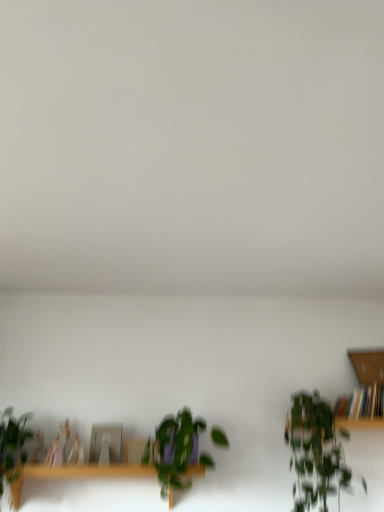
Question: Is green leafy plant at right, marked as the first houseplant in a right-to-left arrangement, beside green leafy plant at center, which appears as the 2th houseplant when viewed from the left?

Choices:
 (A) no
 (B) yes

Answer: (A)

Question: Does green leafy plant at right, marked as the first houseplant in a right-to-left arrangement, have a greater width compared to green leafy plant at center, which appears as the 2th houseplant when viewed from the left?

Choices:
 (A) no
 (B) yes

Answer: (B)

Question: Would you say green leafy plant at right, marked as the first houseplant in a right-to-left arrangement, is a long distance from green leafy plant at center, which appears as the 2th houseplant when viewed from the right?

Choices:
 (A) yes
 (B) no

Answer: (B)

Question: Does green leafy plant at right, the third houseplant positioned from the left, have a lesser height compared to green leafy plant at center, which appears as the 2th houseplant when viewed from the right?

Choices:
 (A) no
 (B) yes

Answer: (A)

Question: Considering the relative positions of green leafy plant at right, marked as the first houseplant in a right-to-left arrangement, and green leafy plant at center, which appears as the 2th houseplant when viewed from the right, in the image provided, is green leafy plant at right, marked as the first houseplant in a right-to-left arrangement, to the left of green leafy plant at center, which appears as the 2th houseplant when viewed from the right, from the viewer's perspective?

Choices:
 (A) yes
 (B) no

Answer: (B)

Question: Can you confirm if green leafy plant at right, the third houseplant positioned from the left, is bigger than green leafy plant at center, which appears as the 2th houseplant when viewed from the left?

Choices:
 (A) no
 (B) yes

Answer: (B)

Question: Considering the relative positions of green matte plant at lower left, which is the third houseplant from right to left, and wooden table at lower center in the image provided, is green matte plant at lower left, which is the third houseplant from right to left, to the left of wooden table at lower center from the viewer's perspective?

Choices:
 (A) yes
 (B) no

Answer: (A)

Question: From the image's perspective, is green matte plant at lower left, which ranks as the first houseplant in left-to-right order, below wooden table at lower center?

Choices:
 (A) no
 (B) yes

Answer: (A)

Question: Is green matte plant at lower left, which ranks as the first houseplant in left-to-right order, placed right next to wooden table at lower center?

Choices:
 (A) yes
 (B) no

Answer: (B)

Question: Can you confirm if green matte plant at lower left, which ranks as the first houseplant in left-to-right order, is positioned to the right of wooden table at lower center?

Choices:
 (A) yes
 (B) no

Answer: (B)

Question: Is green matte plant at lower left, which ranks as the first houseplant in left-to-right order, smaller than wooden table at lower center?

Choices:
 (A) no
 (B) yes

Answer: (B)

Question: Considering the relative sizes of green matte plant at lower left, which is the third houseplant from right to left, and wooden table at lower center in the image provided, is green matte plant at lower left, which is the third houseplant from right to left, thinner than wooden table at lower center?

Choices:
 (A) yes
 (B) no

Answer: (A)

Question: Is wooden table at lower center closer to camera compared to green leafy plant at right, marked as the first houseplant in a right-to-left arrangement?

Choices:
 (A) no
 (B) yes

Answer: (A)